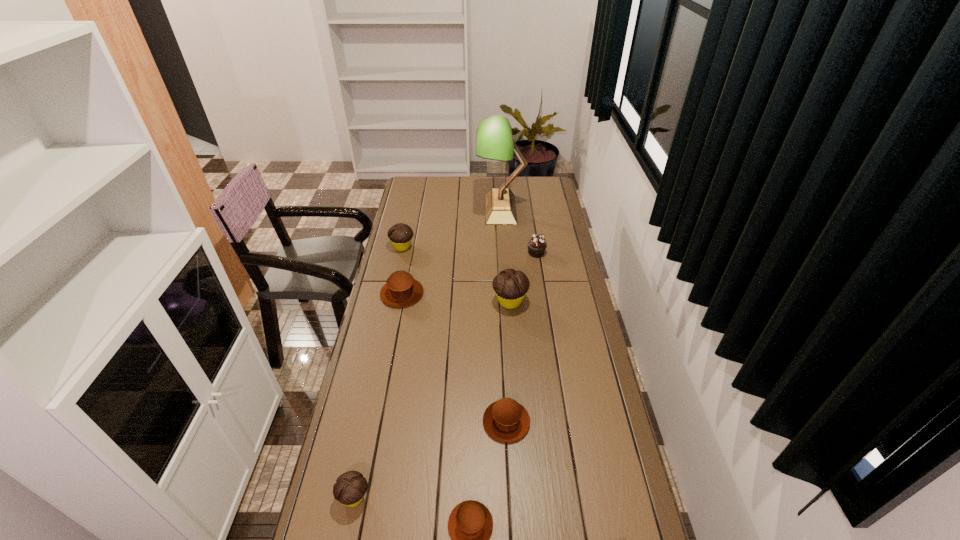
Locate an element on the screen. This screenshot has width=960, height=540. the closest brown muffin to the farthest brown muffin is located at coordinates (505, 420).

The width and height of the screenshot is (960, 540). Identify the location of the closest brown muffin to the leftmost brown muffin. (505, 420).

Locate an element on the screen. The height and width of the screenshot is (540, 960). free space in the image that satisfies the following two spatial constraints: 1. on the metallic stand of the farthest object; 2. on the right side of the second tallest object is located at coordinates (507, 302).

The height and width of the screenshot is (540, 960). In order to click on free space in the image that satisfies the following two spatial constraints: 1. on the metallic stand of the tallest object; 2. on the front side of the second biggest chocolate muffin in this screenshot , I will do `click(503, 247)`.